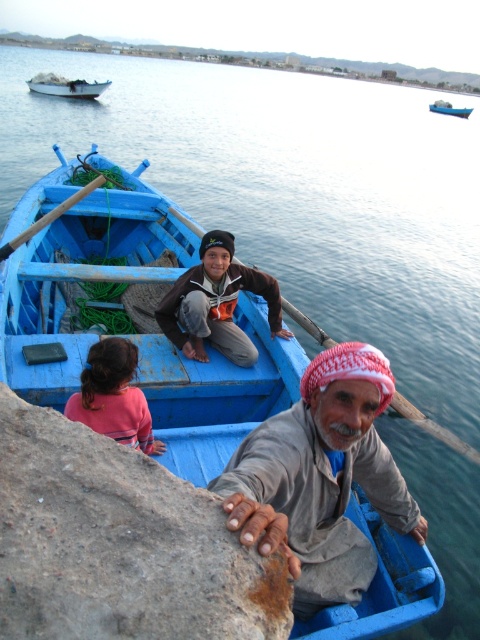
You are a photographer trying to capture the man in the boat. You want to ensure both the gray fabric headscarf at lower center and the brown cotton shirt at center are visible in the frame. Which object should you focus on to include both in the shot?

The gray fabric headscarf at lower center is bigger than the brown cotton shirt at center, so focusing on the gray fabric headscarf at lower center would ensure both are visible in the frame.